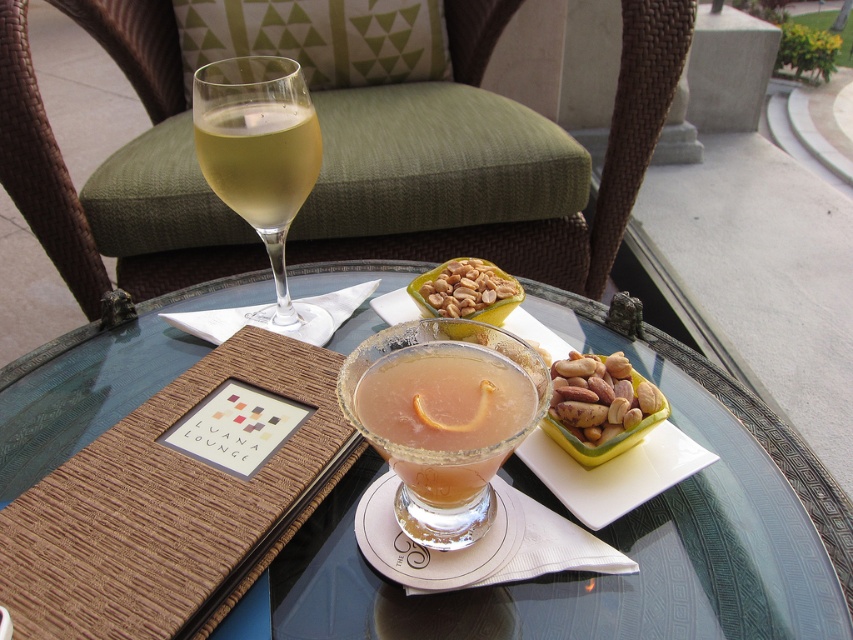
You are standing at the edge of the table and want to reach both points. Which point, point (746,560) or point (440,275), is easier to reach without moving your hand too far?

Point (746,560) is closer to the camera than point (440,275), so it is easier to reach without moving your hand too far.

You are a bartender at the Luana Lounge and need to place a new drink order on the table. The drink must be placed between the translucent glass wine glass at left and the shiny brown nuts at center. Can you fit it there?

The translucent glass wine glass at left is taller than the shiny brown nuts at center, but the question is about fitting a new drink between them. Since the description only mentions their height, not the horizontal space between them, we cannot determine if there is enough room. Please check the distance between the two objects.

You are a server at the Luana Lounge and need to place a 6.5 inch wide dessert plate between the clear glass table at center and the peanutsmoothat upper center. Can you fit it there?

The clear glass table at center and peanutsmoothat upper center are 6.19 inches apart from each other. Since the dessert plate is 6.5 inches wide, which is wider than the space between them, it won